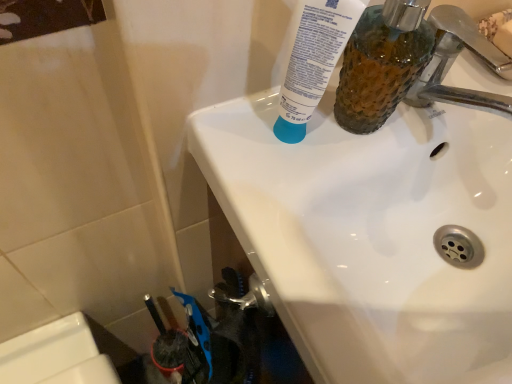
In order to click on free space in front of white matte tube at upper center in this screenshot , I will do `click(296, 236)`.